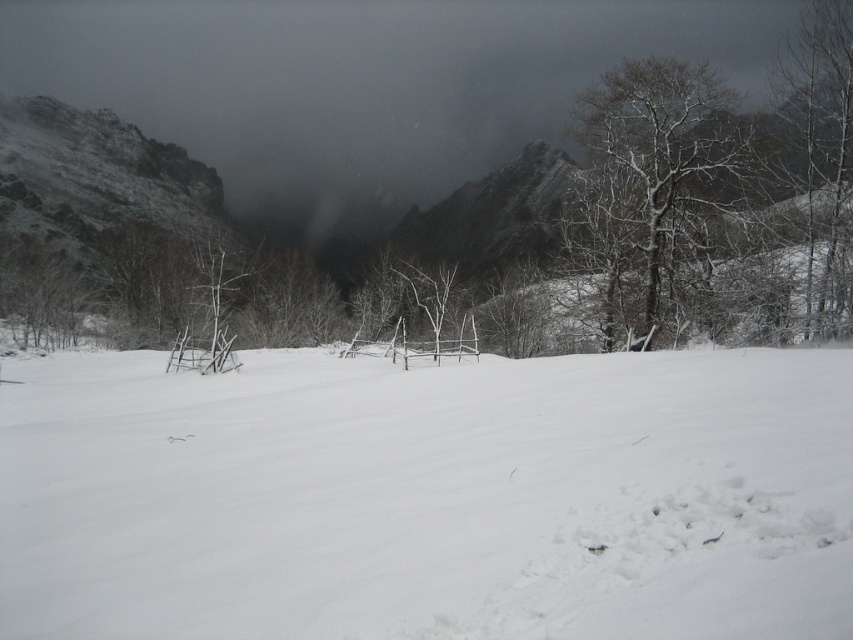
Is snow-covered tree at upper right positioned in front of white matte tree at upper right?

No, snow-covered tree at upper right is behind white matte tree at upper right.

Is snow-covered tree at upper right smaller than white matte tree at upper right?

Incorrect, snow-covered tree at upper right is not smaller in size than white matte tree at upper right.

Between point (631, 74) and point (805, 106), which one is positioned in front?

Point (805, 106)

Find the location of `snow-covered tree at upper right`. snow-covered tree at upper right is located at coordinates (660, 136).

Is white snow at center to the left of white matte tree at upper right from the viewer's perspective?

Yes, white snow at center is to the left of white matte tree at upper right.

Is white snow at center wider than white matte tree at upper right?

Indeed, white snow at center has a greater width compared to white matte tree at upper right.

This screenshot has height=640, width=853. What do you see at coordinates (428, 497) in the screenshot?
I see `white snow at center` at bounding box center [428, 497].

Find the location of `white snow at center`. white snow at center is located at coordinates (428, 497).

This screenshot has width=853, height=640. What do you see at coordinates (428, 497) in the screenshot?
I see `white snow at center` at bounding box center [428, 497].

This screenshot has width=853, height=640. Describe the element at coordinates (428, 497) in the screenshot. I see `white snow at center` at that location.

Identify the location of white snow at center. This screenshot has height=640, width=853. (428, 497).